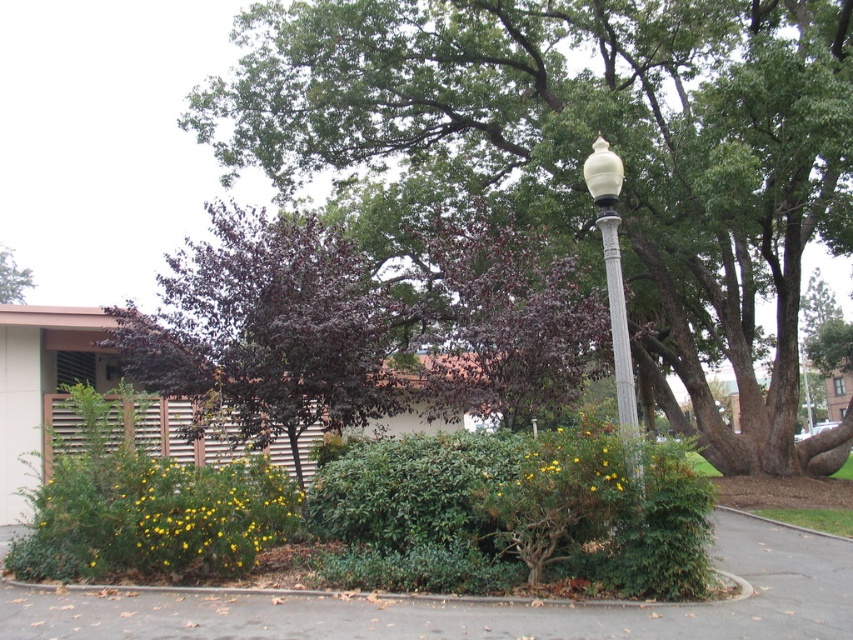
You are standing at the entrance of the building and see two points marked on the ground in the landscaped area. The first point is labeled as point (236, 337) and the second is point (18, 280). Which point is closer to you?

Point (236, 337) is in front of point (18, 280), so it is closer to you.

You are a landscape architect designing a new garden layout. You need to place a bench between the purple glossy tree at center and the green leafy tree at upper left. Given their widths, which tree will require more space on either side of the bench?

The purple glossy tree at center has a larger width than the green leafy tree at upper left, so it will require more space on either side of the bench.